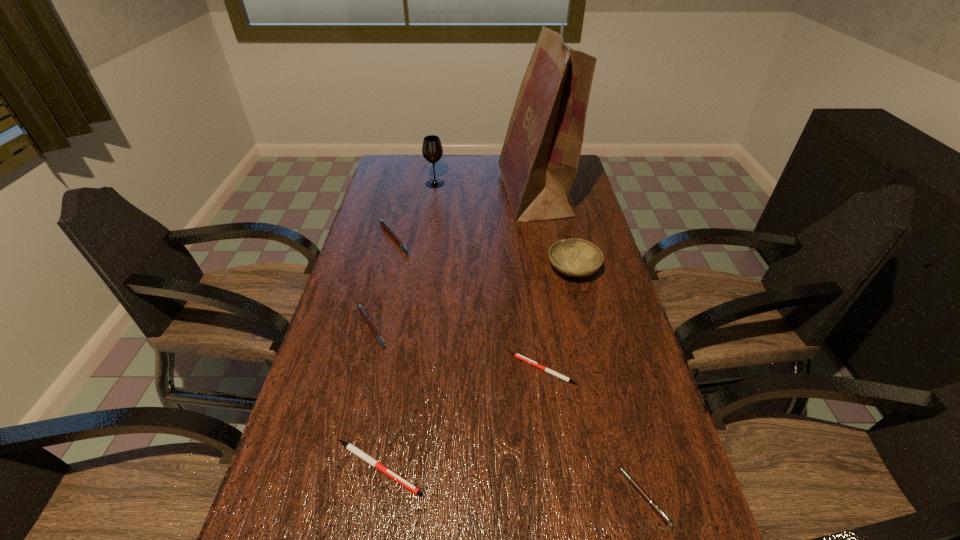
The image size is (960, 540). What are the coordinates of `the left white pen` in the screenshot? It's located at (349, 446).

In order to click on the rightmost pen in this screenshot , I will do `click(656, 508)`.

Identify the location of the nearest pink pen. The width and height of the screenshot is (960, 540). click(x=656, y=508).

Find the location of `the smaller white pen`. the smaller white pen is located at coordinates (517, 355).

The width and height of the screenshot is (960, 540). Find the location of `the farther white pen`. the farther white pen is located at coordinates (517, 355).

The width and height of the screenshot is (960, 540). I want to click on free location located 0.240m on the front-facing side of the grocery bag, so click(437, 194).

Locate an element on the screen. The width and height of the screenshot is (960, 540). vacant region located on the front-facing side of the grocery bag is located at coordinates (461, 194).

At what (x,y) coordinates should I click in order to perform the action: click on vacant region located 0.170m on the front-facing side of the grocery bag. Please return your answer as a coordinate pair (x, y). This screenshot has width=960, height=540. Looking at the image, I should click on (455, 194).

Where is `free space located on the front of the wineglass`? free space located on the front of the wineglass is located at coordinates (427, 238).

This screenshot has width=960, height=540. I want to click on vacant region located on the back of the bowl, so click(561, 217).